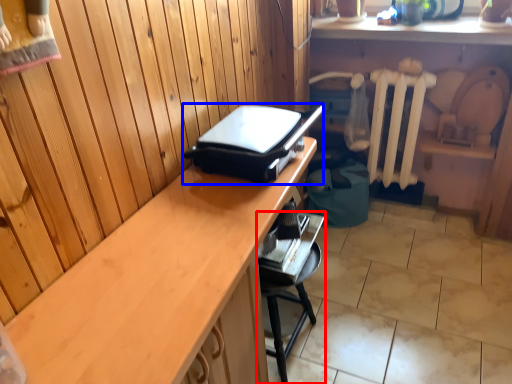
Question: Which object is closer to the camera taking this photo, furniture (highlighted by a red box) or appliance (highlighted by a blue box)?

Choices:
 (A) furniture
 (B) appliance

Answer: (B)